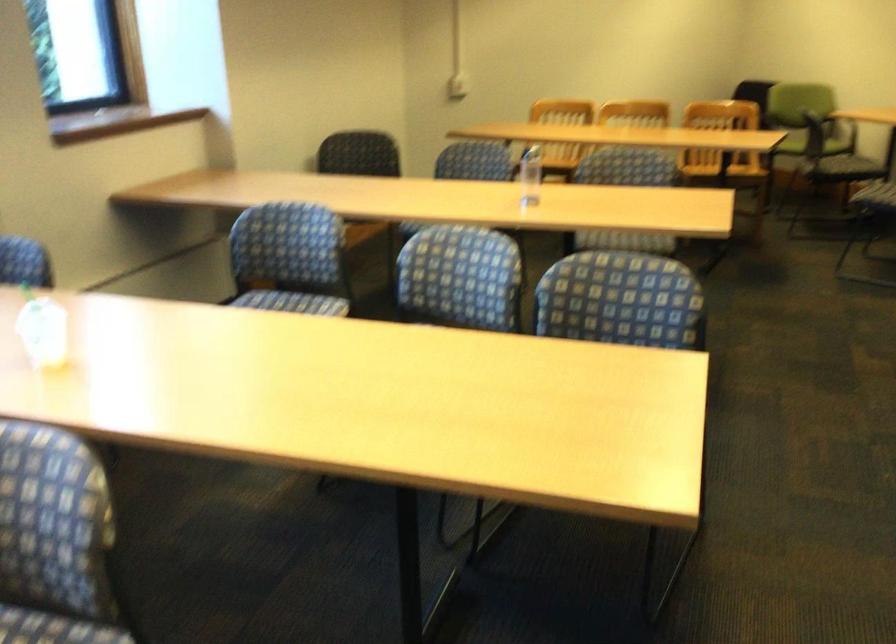
Find where to sit the green chair sitting surface. Please return your answer as a coordinate pair (x, y).

(289, 259)